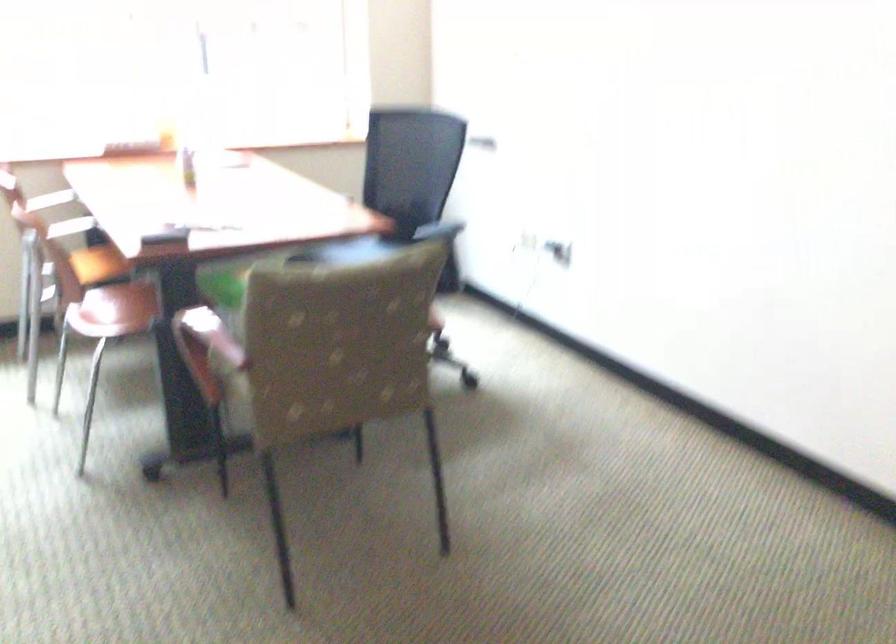
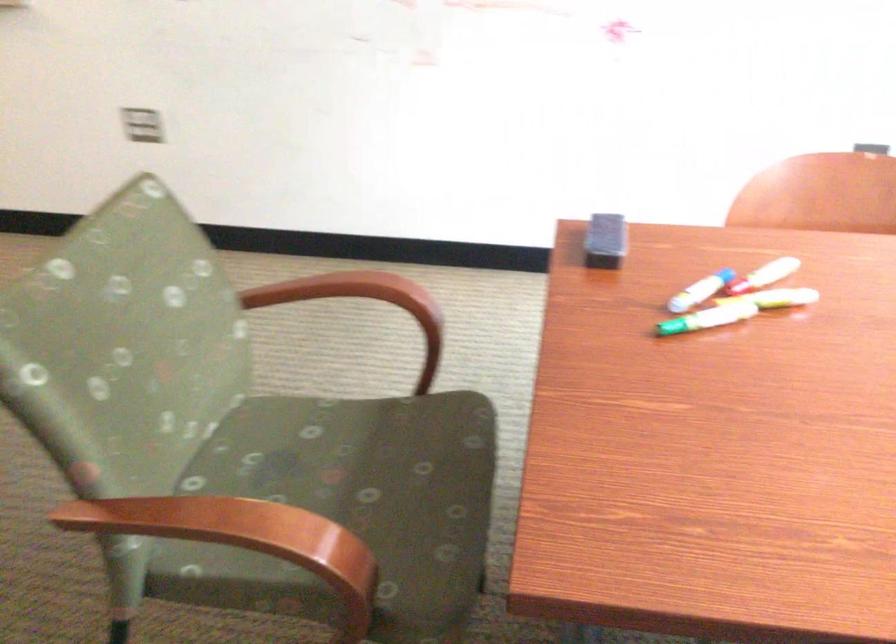
Locate, in the second image, the point that corresponds to the point at 183,319 in the first image.

(346, 290)